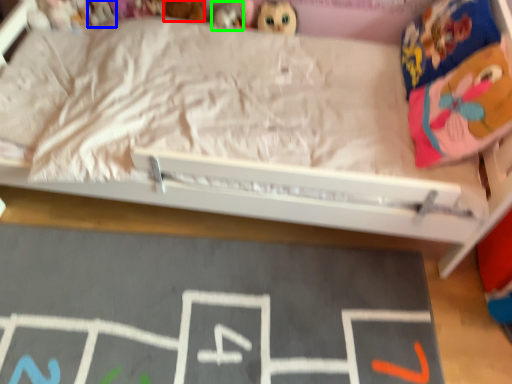
Question: Considering the real-world distances, which object is farthest from toy (highlighted by a red box)? toy (highlighted by a blue box) or toy (highlighted by a green box)?

Choices:
 (A) toy
 (B) toy

Answer: (A)